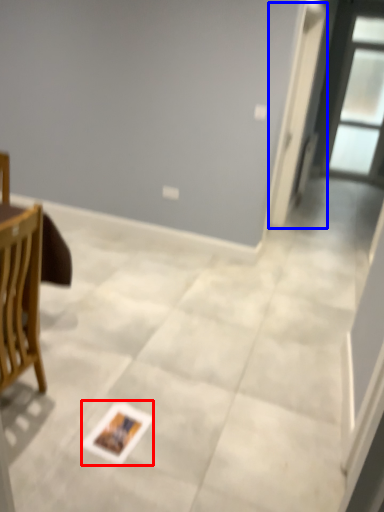
Question: Which point is further to the camera, postcard (highlighted by a red box) or screen door (highlighted by a blue box)?

Choices:
 (A) postcard
 (B) screen door

Answer: (B)